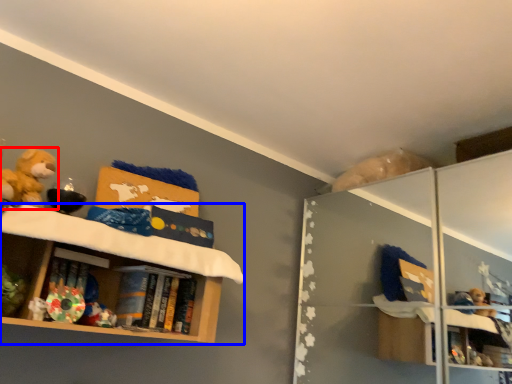
Question: Which object appears closest to the camera in this image, toy (highlighted by a red box) or shelf (highlighted by a blue box)?

Choices:
 (A) toy
 (B) shelf

Answer: (B)